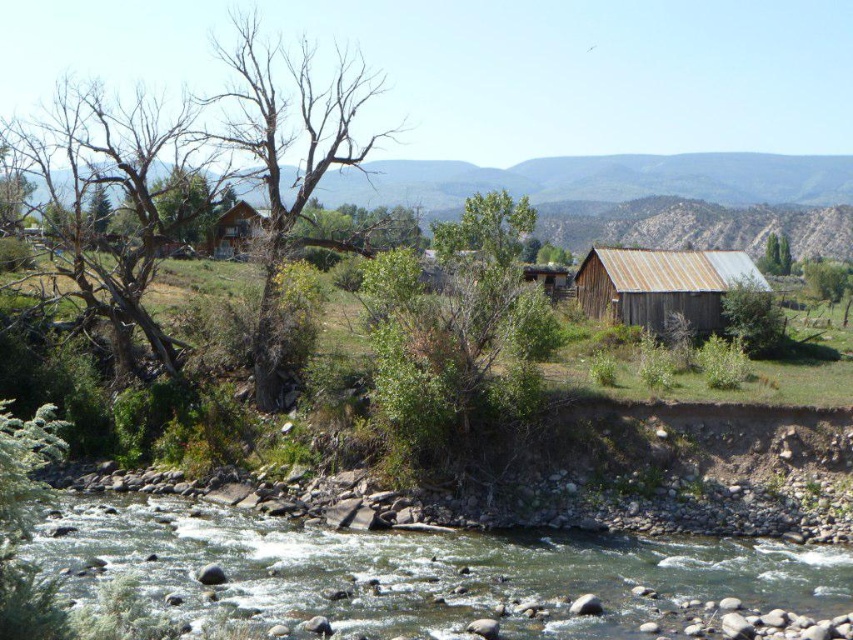
Question: Which point is closer to the camera?

Choices:
 (A) bare wood tree at center
 (B) greenish-brown rocky river at lower center
 (C) bare wood tree at left
 (D) green leafy tree at upper right

Answer: (B)

Question: Among these points, which one is farthest from the camera?

Choices:
 (A) 833,269
 (B) 495,355

Answer: (A)

Question: In this image, where is green leafy tree at center located relative to green leafy tree at right?

Choices:
 (A) right
 (B) left

Answer: (B)

Question: Is green leafy tree at center smaller than bare wood tree at center?

Choices:
 (A) no
 (B) yes

Answer: (B)

Question: Which object is farther from the camera taking this photo?

Choices:
 (A) rusty metal barn at center-right
 (B) bare wood tree at center
 (C) green leafy tree at right
 (D) bare wood tree at left

Answer: (C)

Question: Is green leafy tree at center below brown wooden cabin at upper center?

Choices:
 (A) no
 (B) yes

Answer: (B)